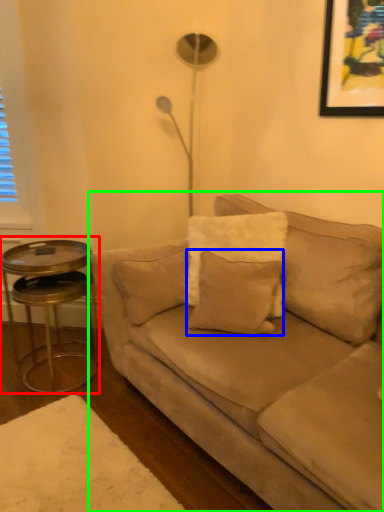
Question: Which object is the closest to the table (highlighted by a red box)? Choose among these: pillow (highlighted by a blue box) or studio couch (highlighted by a green box).

Choices:
 (A) pillow
 (B) studio couch

Answer: (B)